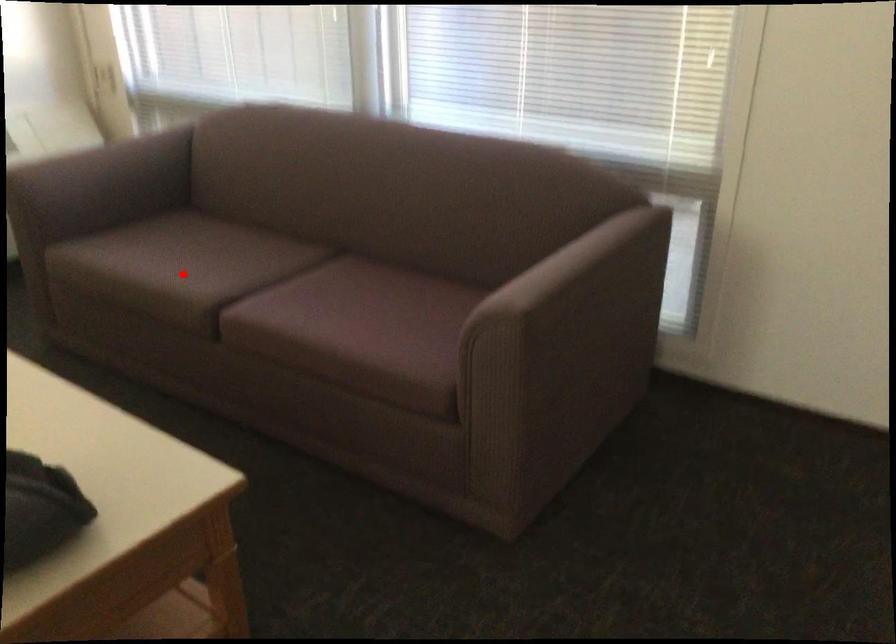
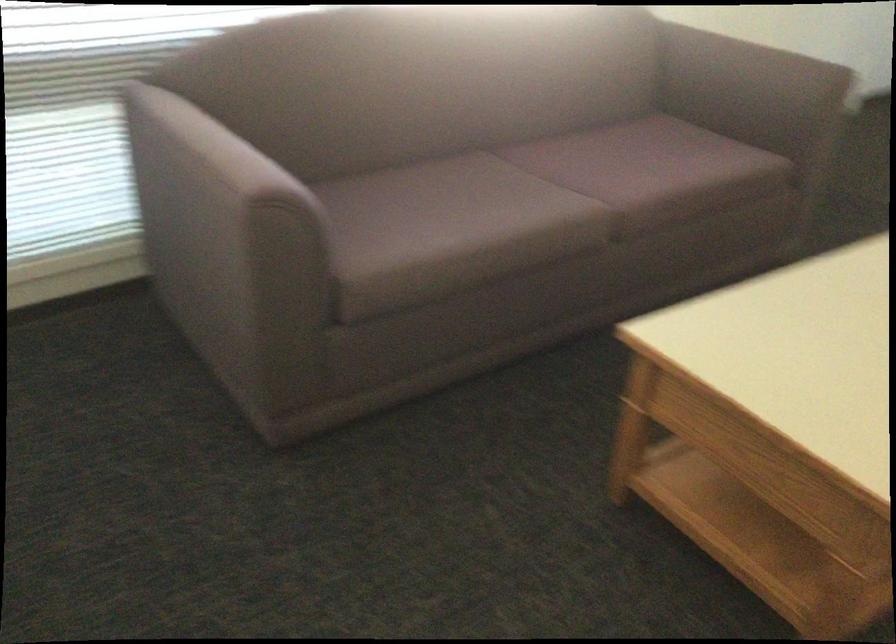
Question: I am providing you with two images of the same scene from different viewpoints. A red point is shown in image1. For the corresponding object point in image2, is it positioned nearer or farther from the camera?

Choices:
 (A) Nearer
 (B) Farther

Answer: (A)